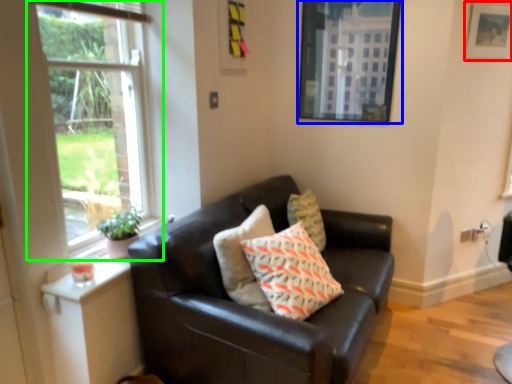
Question: Which is nearer to the picture frame (highlighted by a red box)? picture frame (highlighted by a blue box) or window (highlighted by a green box).

Choices:
 (A) picture frame
 (B) window

Answer: (A)